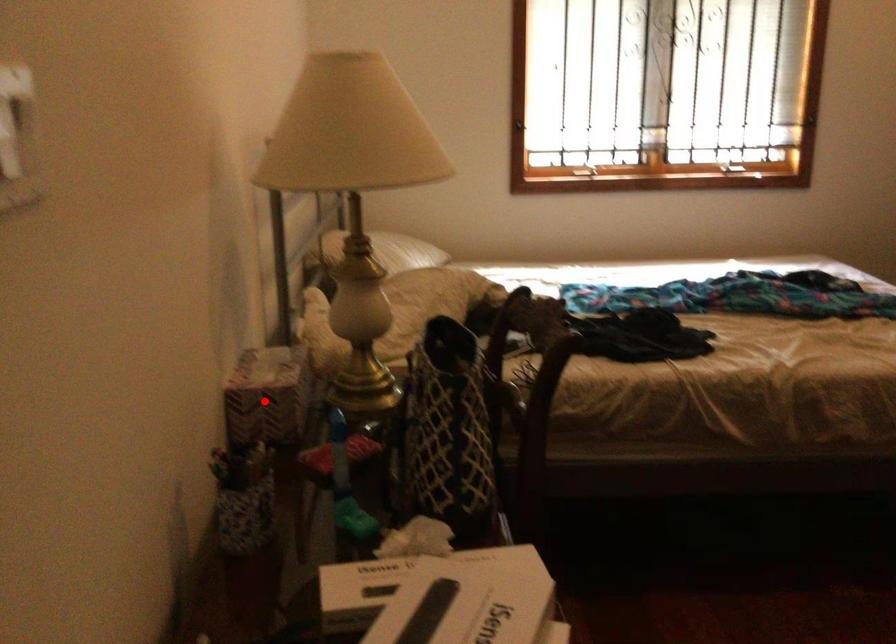
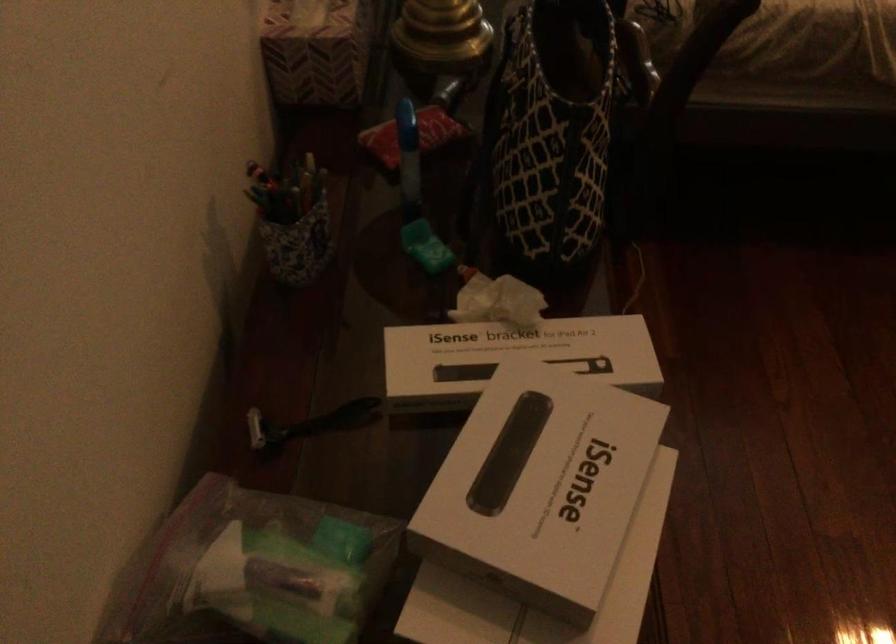
Find the pixel in the second image that matches the highlighted location in the first image.

(315, 51)